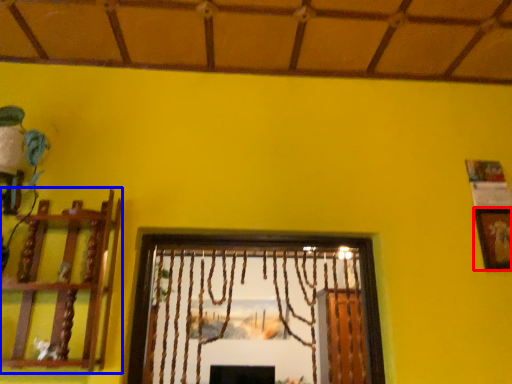
Question: Among these objects, which one is farthest to the camera, picture frame (highlighted by a red box) or shelf (highlighted by a blue box)?

Choices:
 (A) picture frame
 (B) shelf

Answer: (A)